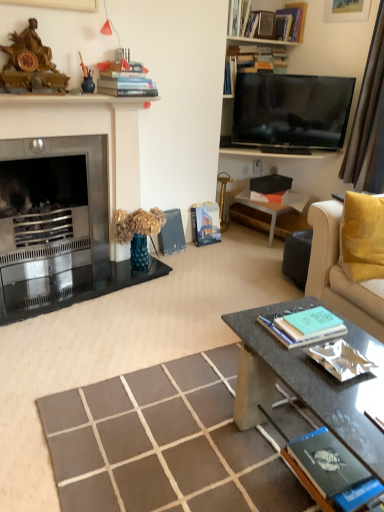
At what (x,y) coordinates should I click in order to perform the action: click on free space above teal matte book at center, the 3th book when ordered from bottom to top (from a real-world perspective). Please return your answer as a coordinate pair (x, y). This screenshot has width=384, height=512. Looking at the image, I should click on (305, 323).